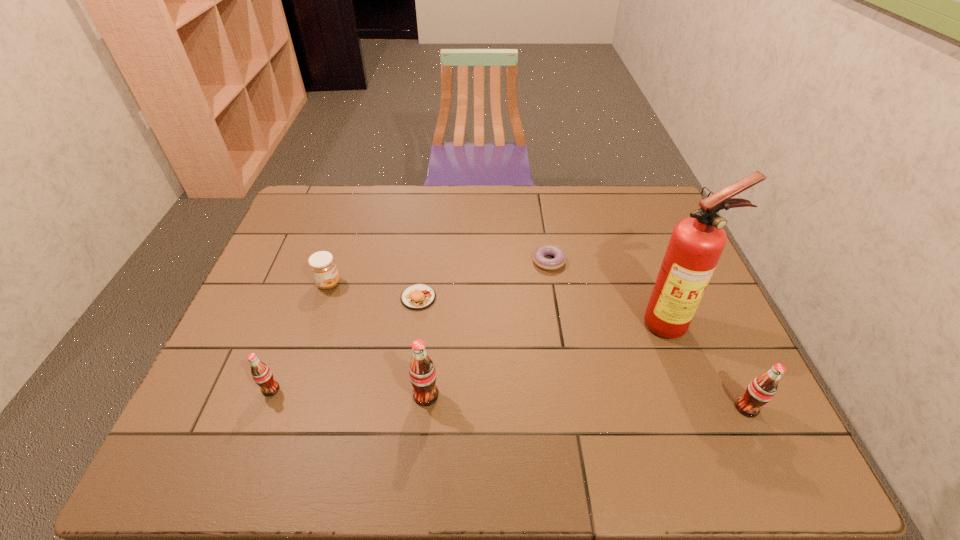
Identify the location of soda that is the closest to the shortest soda. (422, 373).

The image size is (960, 540). Find the location of `soda that stands as the closest to the leftmost soda`. soda that stands as the closest to the leftmost soda is located at coordinates (422, 373).

The image size is (960, 540). In order to click on free region that satisfies the following two spatial constraints: 1. on the back side of the patty; 2. on the left side of the leftmost soda in this screenshot , I will do (305, 298).

In order to click on vacant space that satisfies the following two spatial constraints: 1. on the front side of the leftmost soda; 2. on the left side of the second shortest soda in this screenshot , I will do `click(264, 408)`.